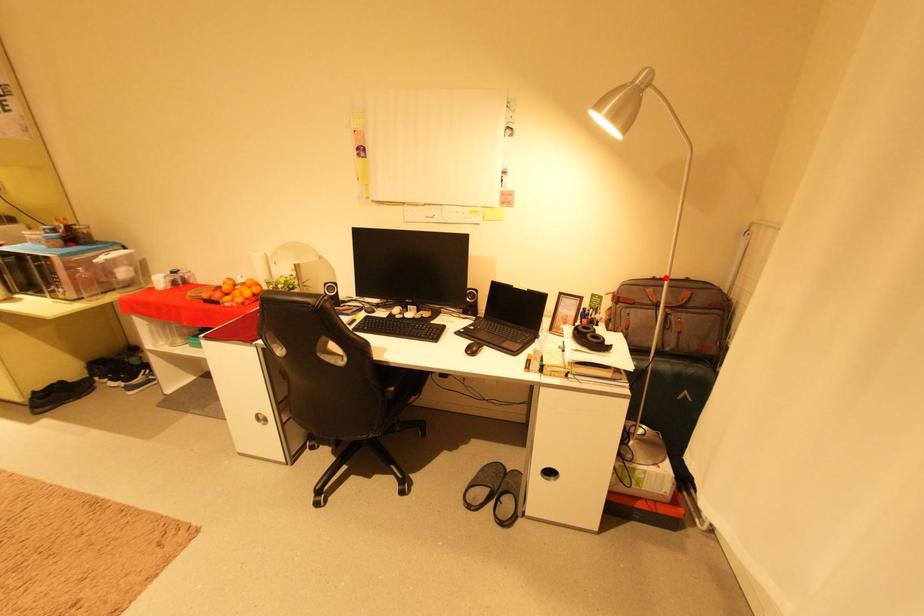
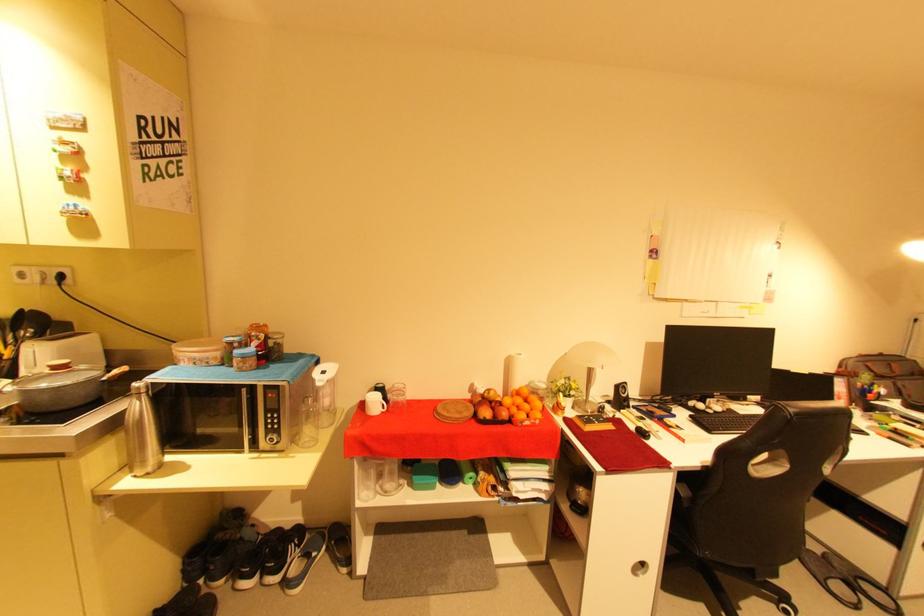
Where in the second image is the point corresponding to the highlighted location from the first image?

(871, 354)